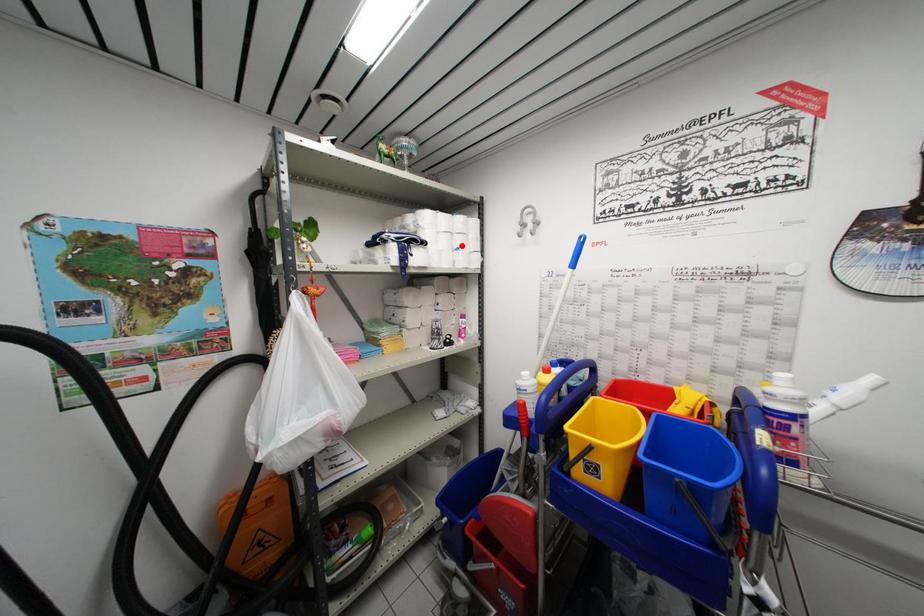
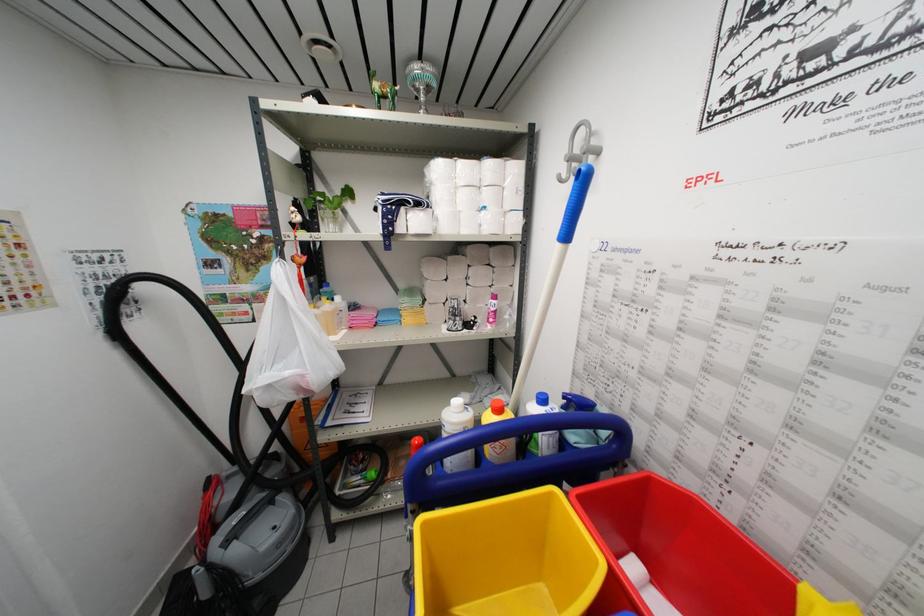
The point at the highlighted location is marked in the first image. Where is the corresponding point in the second image?

(490, 201)